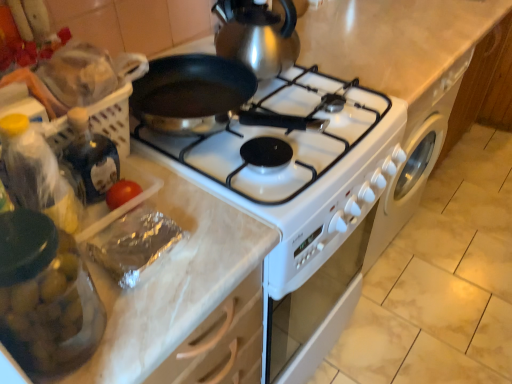
This screenshot has width=512, height=384. I want to click on free spot in front of silver foil meat at lower left, so click(x=148, y=315).